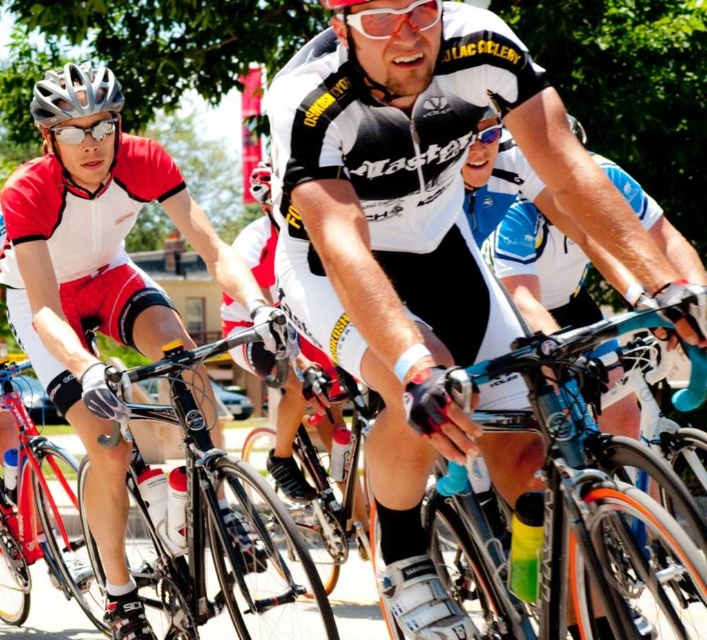
You are a photographer positioned at the starting line of the race. You want to capture a photo of both the silver metallic helmet at upper left and the red translucent goggles at center. Which object should you focus on first to ensure it appears sharp in the photo?

You should focus on the silver metallic helmet at upper left first because it is closer to you than the red translucent goggles at center, so it requires proper focus before adjusting for the other object.

You are a photographer positioned at the back of the cyclists. You want to take a photo of the black matte bicycle at center without the red translucent goggles at center blocking the view. Is the bicycle currently visible in your shot?

The black matte bicycle at center is positioned under the red translucent goggles at center, so the goggles are blocking the view of the bicycle. You cannot see the black matte bicycle at center in your photo without adjusting your angle or moving the goggles.

You are standing at the camera position and want to know how far the point at coordinates point (397, 8) is from you. Can you determine the distance?

The point (397, 8) is 8.68 meters from the camera, so the distance is 8.68 meters.